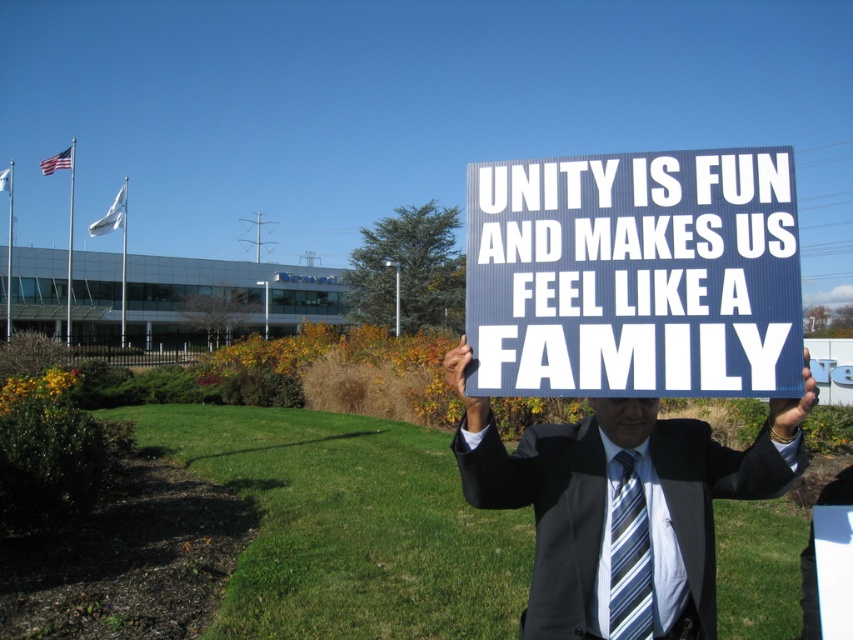
You are a fashion designer observing a person wearing a dark gray suit at center and a striped fabric tie at center. Which clothing item is more to the left?

The dark gray suit at center is positioned on the left side of striped fabric tie at center, so the dark gray suit at center is more to the left.

You are a photographer adjusting your camera settings to capture the scene. You want to ensure both the blue corrugated plastic sign at center and the striped fabric tie at center are in focus. The camera has a depth of field that can cover 17 inches. Will both objects be in focus?

The blue corrugated plastic sign at center and the striped fabric tie at center are 17.33 inches apart from each other. Since the camera has a depth of field of 17 inches, which is slightly less than the distance between them, both objects might not be fully in focus simultaneously.

From the picture: You are a fashion designer observing the person in the image. You need to determine the placement of the dark gray suit at center and striped fabric tie at center. Which one is positioned higher on the person?

The dark gray suit at center is located above the striped fabric tie at center, so the dark gray suit at center is positioned higher on the person.